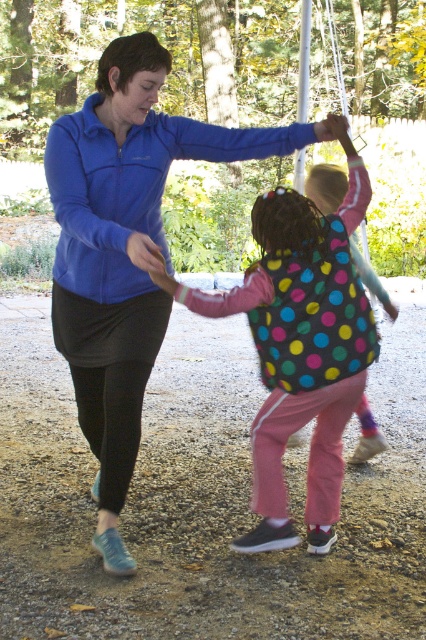
You are standing in the park and see two points marked in the image. Which point, point (85, 138) or point (261, 332), is closer to you?

Point (85, 138) is closer to the camera than point (261, 332).

Consider the image. You are a photographer trying to capture a photo of both the blue fleece jacket at center and the polka dot fabric jacket at center. Since you want to ensure both are clearly visible in the frame, which jacket should you focus on first to make sure it is sharp?

You should focus on the blue fleece jacket at center first because it is in front of the polka dot fabric jacket at center, so ensuring it is sharp will also help the background jacket be in focus if they are within the same depth of field.